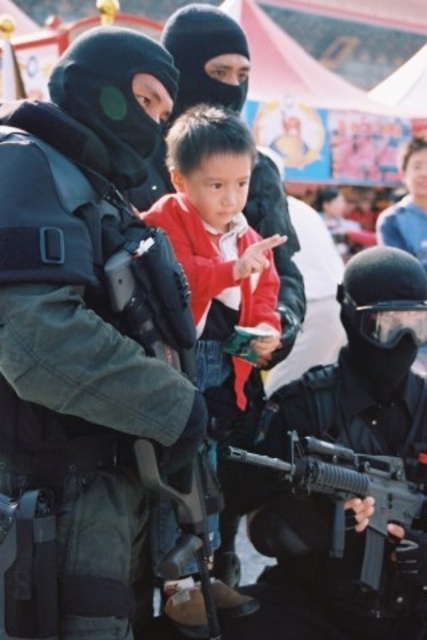
You are a security officer assessing the scene. You see the red matte jacket at center and the matte black rifle at lower center. Which object is taller in the image?

The red matte jacket at center is much taller than the matte black rifle at lower center.

You are an observer trying to assess the visibility of objects in this scene. Which object, the matte black tactical vest at center or the matte black rifle at lower center, would appear taller when viewed from your perspective?

The matte black tactical vest at center appears taller than the matte black rifle at lower center according to the description.

You are a drone operator trying to locate the matte black tactical vest at center in the image. According to the coordinates provided, where would you direct your drone to focus?

The matte black tactical vest at center is located at coordinates point (85, 340).